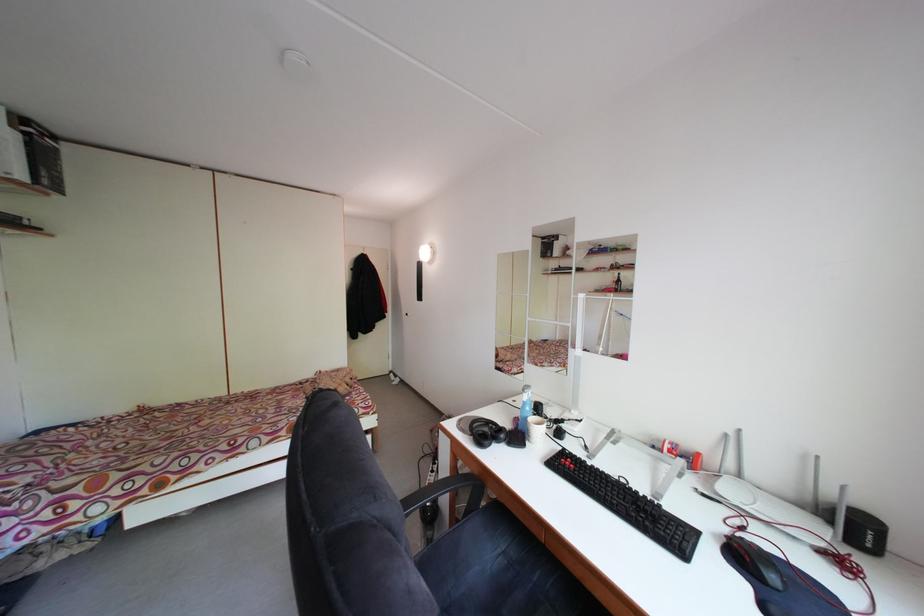
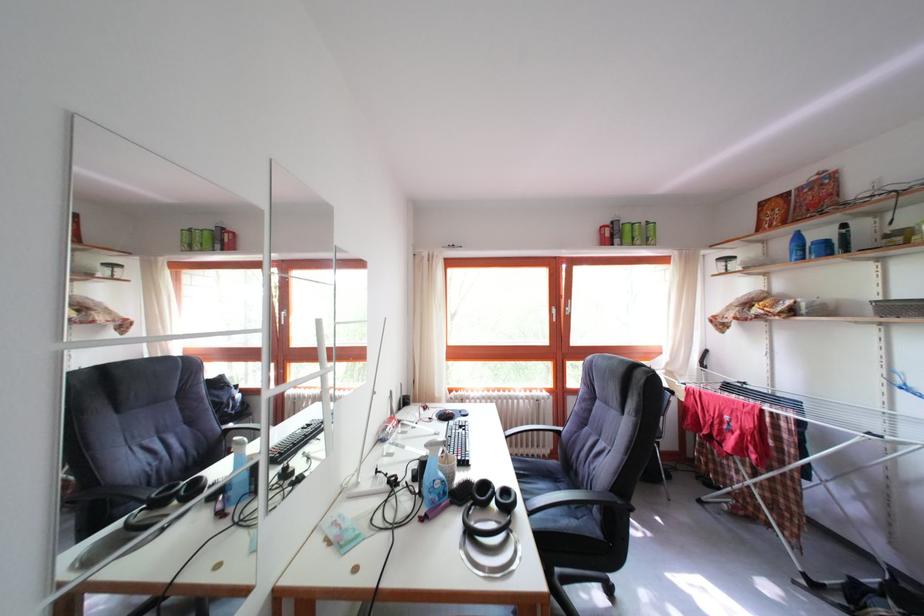
Find the pixel in the second image that matches pixel 488 440 in the first image.

(517, 506)